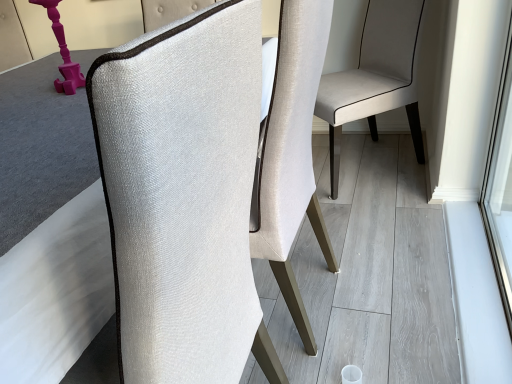
Question: Does textured fabric chair at center, placed as the 1th chair when sorted from front to back, have a lesser width compared to matte pink plastic table lamp at left?

Choices:
 (A) yes
 (B) no

Answer: (B)

Question: From a real-world perspective, is textured fabric chair at center, placed as the 1th chair when sorted from front to back, physically above matte pink plastic table lamp at left?

Choices:
 (A) yes
 (B) no

Answer: (B)

Question: Can you confirm if textured fabric chair at center, the second chair positioned from the back, is taller than matte pink plastic table lamp at left?

Choices:
 (A) no
 (B) yes

Answer: (B)

Question: Is textured fabric chair at center, the second chair positioned from the back, turned away from matte pink plastic table lamp at left?

Choices:
 (A) yes
 (B) no

Answer: (B)

Question: Considering the relative positions of textured fabric chair at center, the second chair positioned from the back, and matte pink plastic table lamp at left in the image provided, is textured fabric chair at center, the second chair positioned from the back, to the right of matte pink plastic table lamp at left from the viewer's perspective?

Choices:
 (A) yes
 (B) no

Answer: (A)

Question: Does textured fabric chair at center, the second chair positioned from the back, have a smaller size compared to matte pink plastic table lamp at left?

Choices:
 (A) yes
 (B) no

Answer: (B)

Question: Can you confirm if matte pink plastic table lamp at left is positioned to the left of textured beige chair at center, which ranks as the 1th chair in back-to-front order?

Choices:
 (A) yes
 (B) no

Answer: (A)

Question: Is matte pink plastic table lamp at left facing away from textured beige chair at center, placed as the second chair when sorted from front to back?

Choices:
 (A) no
 (B) yes

Answer: (A)

Question: Is matte pink plastic table lamp at left bigger than textured beige chair at center, placed as the second chair when sorted from front to back?

Choices:
 (A) no
 (B) yes

Answer: (A)

Question: Is matte pink plastic table lamp at left outside of textured beige chair at center, which ranks as the 1th chair in back-to-front order?

Choices:
 (A) no
 (B) yes

Answer: (B)

Question: From the image's perspective, is matte pink plastic table lamp at left beneath textured beige chair at center, which ranks as the 1th chair in back-to-front order?

Choices:
 (A) no
 (B) yes

Answer: (B)

Question: Does matte pink plastic table lamp at left turn towards textured beige chair at center, placed as the second chair when sorted from front to back?

Choices:
 (A) no
 (B) yes

Answer: (A)

Question: Is textured beige chair at center, which ranks as the 1th chair in back-to-front order, directly adjacent to matte pink plastic table lamp at left?

Choices:
 (A) yes
 (B) no

Answer: (B)